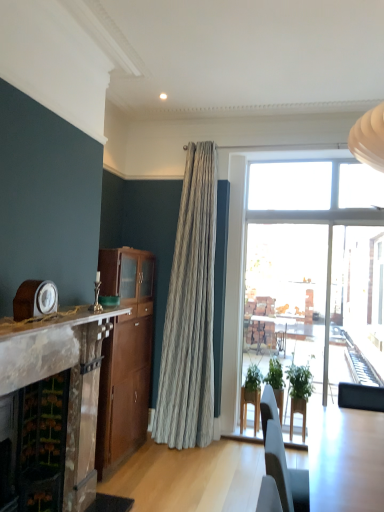
What is the approximate width of marble fireplace at left?

marble fireplace at left is 23.98 inches wide.

Describe the element at coordinates (125, 357) in the screenshot. The image size is (384, 512). I see `wooden cabinet at center` at that location.

At what (x,y) coordinates should I click in order to perform the action: click on green matte plant at center, which ranks as the first houseplant in left-to-right order. Please return your answer as a coordinate pair (x, y). Image resolution: width=384 pixels, height=512 pixels. Looking at the image, I should click on (251, 397).

What is the approximate height of green matte plant at center, which ranks as the first houseplant in left-to-right order?

green matte plant at center, which ranks as the first houseplant in left-to-right order, is 78.00 centimeters in height.

This screenshot has height=512, width=384. Describe the element at coordinates (59, 320) in the screenshot. I see `marble mantel at left` at that location.

Image resolution: width=384 pixels, height=512 pixels. What are the coordinates of `marble mantel at left` in the screenshot? It's located at (59, 320).

Locate an element on the screen. Image resolution: width=384 pixels, height=512 pixels. green leafy plant at center, which is the 1th houseplant from right to left is located at coordinates (299, 393).

The width and height of the screenshot is (384, 512). Identify the location of marble fireplace at left. (70, 382).

Would you consider marble mantel at left to be distant from green leafy plant at center, arranged as the second houseplant when viewed from the left?

Indeed, marble mantel at left is not near green leafy plant at center, arranged as the second houseplant when viewed from the left.

Is marble mantel at left positioned with its back to green leafy plant at center, arranged as the second houseplant when viewed from the left?

That's not correct — marble mantel at left is not looking away from green leafy plant at center, arranged as the second houseplant when viewed from the left.

From a real-world perspective, between marble mantel at left and green leafy plant at center, which is the 1th houseplant from right to left, who is vertically lower?

green leafy plant at center, which is the 1th houseplant from right to left.

From the image's perspective, is marble mantel at left beneath green leafy plant at center, which is the 1th houseplant from right to left?

No.

Considering their positions, is marble mantel at left located in front of or behind green matte plant at center, which ranks as the first houseplant in left-to-right order?

Clearly, marble mantel at left is in front of green matte plant at center, which ranks as the first houseplant in left-to-right order.

Is marble mantel at left to the left or to the right of green matte plant at center, which is the second houseplant in right-to-left order, in the image?

marble mantel at left is positioned on green matte plant at center, which is the second houseplant in right-to-left order,'s left side.

This screenshot has height=512, width=384. What are the coordinates of `mantle positioned vertically above the green matte plant at center, which ranks as the first houseplant in left-to-right order (from a real-world perspective)` in the screenshot? It's located at point(59,320).

Between marble mantel at left and green matte plant at center, which ranks as the first houseplant in left-to-right order, which one has larger width?

With larger width is marble mantel at left.

The width and height of the screenshot is (384, 512). Identify the location of cabinetry that appears above the light wood table at lower right (from a real-world perspective). (125, 357).

Can we say light wood table at lower right lies outside wooden cabinet at center?

Yes.

From the picture: Is light wood table at lower right thinner than wooden cabinet at center?

Incorrect, the width of light wood table at lower right is not less than that of wooden cabinet at center.

Can you tell me how much green leafy plant at center, arranged as the second houseplant when viewed from the left, and wooden clock at left differ in facing direction?

There is a 93.5-degree angle between the facing directions of green leafy plant at center, arranged as the second houseplant when viewed from the left, and wooden clock at left.

Is green leafy plant at center, arranged as the second houseplant when viewed from the left, looking in the opposite direction of wooden clock at left?

No, green leafy plant at center, arranged as the second houseplant when viewed from the left,'s orientation is not away from wooden clock at left.

Can you confirm if green leafy plant at center, arranged as the second houseplant when viewed from the left, is smaller than wooden clock at left?

Actually, green leafy plant at center, arranged as the second houseplant when viewed from the left, might be larger than wooden clock at left.

Considering the relative sizes of green leafy plant at center, arranged as the second houseplant when viewed from the left, and wooden clock at left in the image provided, is green leafy plant at center, arranged as the second houseplant when viewed from the left, shorter than wooden clock at left?

No, green leafy plant at center, arranged as the second houseplant when viewed from the left, is not shorter than wooden clock at left.

Is marble fireplace at left inside the boundaries of marble mantel at left, or outside?

marble fireplace at left exists outside the volume of marble mantel at left.

Is marble fireplace at left next to marble mantel at left?

No, marble fireplace at left is not making contact with marble mantel at left.

Considering their positions, is marble fireplace at left located in front of or behind marble mantel at left?

In the image, marble fireplace at left appears behind marble mantel at left.

Does point (54, 328) come in front of point (30, 294)?

That is False.

Which object is positioned more to the left, marble fireplace at left or wooden clock at left?

marble fireplace at left.

Who is bigger, marble fireplace at left or wooden clock at left?

marble fireplace at left.

Is marble fireplace at left closer to camera compared to wooden clock at left?

Yes, it is.

Between marble fireplace at left and green matte plant at center, which is the second houseplant in right-to-left order, which one has smaller size?

green matte plant at center, which is the second houseplant in right-to-left order, is smaller.

Can you tell me how much marble fireplace at left and green matte plant at center, which ranks as the first houseplant in left-to-right order, differ in facing direction?

There is a 92.2-degree angle between the facing directions of marble fireplace at left and green matte plant at center, which ranks as the first houseplant in left-to-right order.

From the image's perspective, is marble fireplace at left located above or below green matte plant at center, which ranks as the first houseplant in left-to-right order?

marble fireplace at left is situated higher than green matte plant at center, which ranks as the first houseplant in left-to-right order, in the image.

Does marble fireplace at left turn towards green matte plant at center, which ranks as the first houseplant in left-to-right order?

No, marble fireplace at left does not turn towards green matte plant at center, which ranks as the first houseplant in left-to-right order.

The image size is (384, 512). I want to click on the 1st houseplant behind when counting from the marble mantel at left, so click(x=299, y=393).

Locate an element on the screen. The width and height of the screenshot is (384, 512). houseplant that is the 2nd object located below the marble mantel at left (from the image's perspective) is located at coordinates (251, 397).

From the image, which object appears to be farther from marble fireplace at left, light wood table at lower right or wooden clock at left?

light wood table at lower right is positioned further to the anchor marble fireplace at left.

From the image, which object appears to be nearer to green matte plant at center, which ranks as the first houseplant in left-to-right order, wooden clock at left or wooden cabinet at center?

wooden cabinet at center lies closer to green matte plant at center, which ranks as the first houseplant in left-to-right order, than the other object.

Looking at the image, which one is located further to green matte plant at center, which is the second houseplant in right-to-left order, marble mantel at left or wooden clock at left?

wooden clock at left.

Based on their spatial positions, is marble fireplace at left or light wood table at lower right further from green matte plant at center, which is the second houseplant in right-to-left order?

marble fireplace at left lies further to green matte plant at center, which is the second houseplant in right-to-left order, than the other object.

Estimate the real-world distances between objects in this image. Which object is further from green matte plant at center, which is the second houseplant in right-to-left order, light wood table at lower right or wooden cabinet at center?

light wood table at lower right is positioned further to the anchor green matte plant at center, which is the second houseplant in right-to-left order.

When comparing their distances from green leafy plant at center, arranged as the second houseplant when viewed from the left, does marble fireplace at left or marble mantel at left seem closer?

Based on the image, marble mantel at left appears to be nearer to green leafy plant at center, arranged as the second houseplant when viewed from the left.

Based on their spatial positions, is green leafy plant at center, which is the 1th houseplant from right to left, or marble fireplace at left further from light wood table at lower right?

The object further to light wood table at lower right is marble fireplace at left.

From the image, which object appears to be nearer to green leafy plant at center, which is the 1th houseplant from right to left, light wood table at lower right or wooden clock at left?

light wood table at lower right lies closer to green leafy plant at center, which is the 1th houseplant from right to left, than the other object.

Locate an element on the screen. The width and height of the screenshot is (384, 512). clock between marble fireplace at left and green matte plant at center, which is the second houseplant in right-to-left order, from front to back is located at coordinates (35, 298).

Locate an element on the screen. This screenshot has height=512, width=384. houseplant between wooden cabinet at center and green leafy plant at center, which is the 1th houseplant from right to left is located at coordinates (251, 397).

Find the location of `cabinetry between light wood table at lower right and green leafy plant at center, arranged as the second houseplant when viewed from the left, in the front-back direction`. cabinetry between light wood table at lower right and green leafy plant at center, arranged as the second houseplant when viewed from the left, in the front-back direction is located at coordinates (125, 357).

The width and height of the screenshot is (384, 512). I want to click on fireplace positioned between marble mantel at left and green leafy plant at center, which is the 1th houseplant from right to left, from near to far, so click(70, 382).